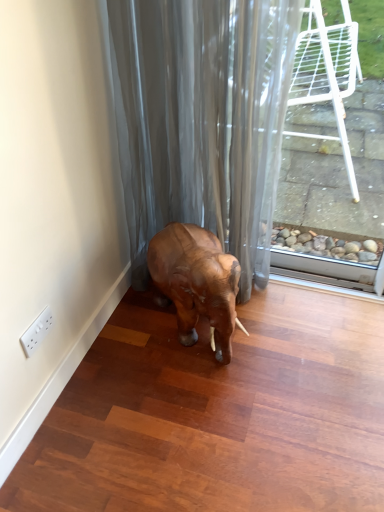
Question: Looking at the image, does brown wooden elephant at center seem bigger or smaller compared to satin gray curtain at lower center?

Choices:
 (A) big
 (B) small

Answer: (B)

Question: From a real-world perspective, is brown wooden elephant at center above or below satin gray curtain at lower center?

Choices:
 (A) below
 (B) above

Answer: (A)

Question: Considering the positions of brown wooden elephant at center and satin gray curtain at lower center in the image, is brown wooden elephant at center taller or shorter than satin gray curtain at lower center?

Choices:
 (A) tall
 (B) short

Answer: (B)

Question: Does point (165, 74) appear closer or farther from the camera than point (183, 272)?

Choices:
 (A) closer
 (B) farther

Answer: (B)

Question: In terms of height, does satin gray curtain at lower center look taller or shorter compared to brown wooden elephant at center?

Choices:
 (A) short
 (B) tall

Answer: (B)

Question: Relative to brown wooden elephant at center, is satin gray curtain at lower center in front or behind?

Choices:
 (A) behind
 (B) front

Answer: (B)

Question: Choose the correct answer: Is satin gray curtain at lower center inside brown wooden elephant at center or outside it?

Choices:
 (A) outside
 (B) inside

Answer: (A)